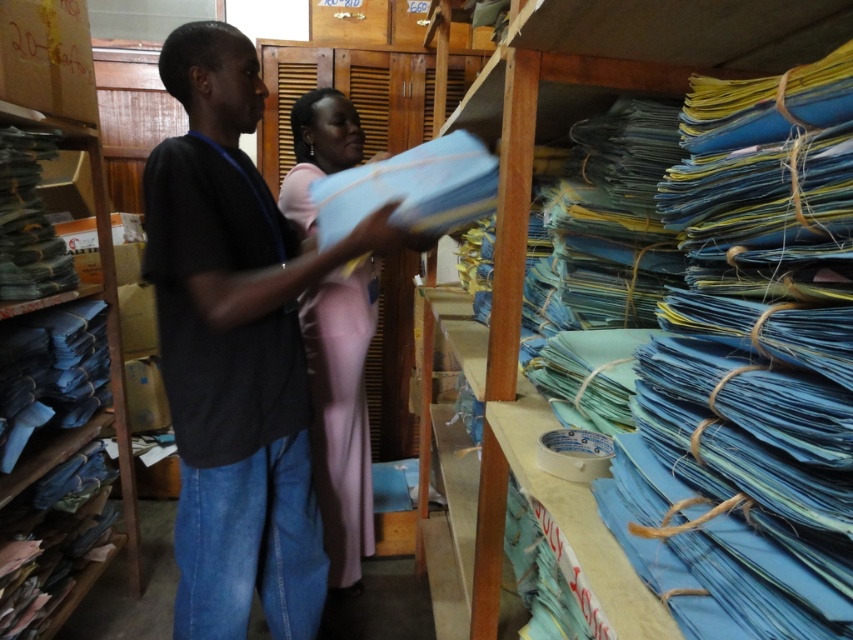
Question: Is blue paper at right behind pink fabric at center?

Choices:
 (A) yes
 (B) no

Answer: (B)

Question: Among these objects, which one is farthest from the camera?

Choices:
 (A) pink fabric at center
 (B) blue paper at right

Answer: (A)

Question: Which is farther from the blue paper at right?

Choices:
 (A) black matte shirt at center
 (B) pink fabric at center

Answer: (B)

Question: In this image, where is blue paper at right located relative to black matte shirt at center?

Choices:
 (A) left
 (B) right

Answer: (B)

Question: Is black matte shirt at center to the left of pink fabric at center from the viewer's perspective?

Choices:
 (A) yes
 (B) no

Answer: (A)

Question: Which point is farther to the camera?

Choices:
 (A) (683, 300)
 (B) (314, 147)

Answer: (B)